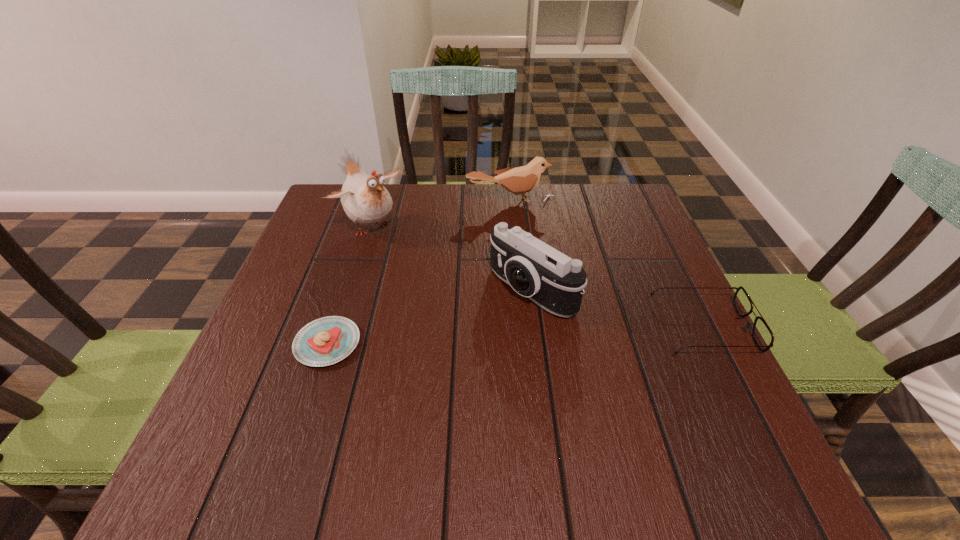
What are the coordinates of `object located in the right edge section of the desktop` in the screenshot? It's located at (763, 337).

In order to click on object at the far left corner in this screenshot , I will do [365, 200].

Where is `vacant region at the far edge of the desktop`? The image size is (960, 540). vacant region at the far edge of the desktop is located at coordinates (464, 192).

The height and width of the screenshot is (540, 960). What are the coordinates of `blank area at the near edge` in the screenshot? It's located at (469, 389).

This screenshot has height=540, width=960. I want to click on blank space at the left edge, so click(332, 268).

Image resolution: width=960 pixels, height=540 pixels. What are the coordinates of `vacant space at the right edge of the desktop` in the screenshot? It's located at (679, 342).

The image size is (960, 540). Identify the location of free space at the far left corner of the desktop. (333, 212).

In the image, there is a desktop. At what (x,y) coordinates should I click in order to perform the action: click on vacant space at the near left corner. Please return your answer as a coordinate pair (x, y). Looking at the image, I should click on (246, 430).

Where is `free space at the far right corner of the desktop`? free space at the far right corner of the desktop is located at coordinates (586, 201).

The height and width of the screenshot is (540, 960). Find the location of `free space between the second shortest object and the camera`. free space between the second shortest object and the camera is located at coordinates (617, 309).